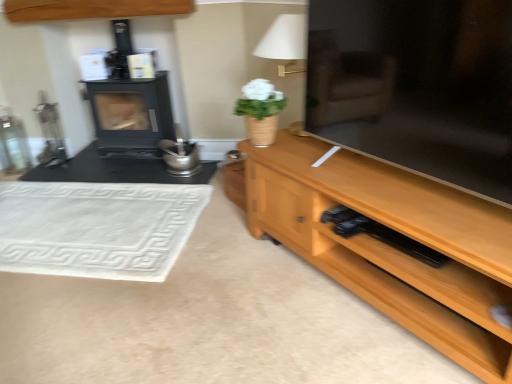
Question: Does point (36, 8) appear closer or farther from the camera than point (244, 102)?

Choices:
 (A) farther
 (B) closer

Answer: (A)

Question: Considering the positions of wooden cabinet at upper center and white matte vase at center in the image, is wooden cabinet at upper center wider or thinner than white matte vase at center?

Choices:
 (A) thin
 (B) wide

Answer: (A)

Question: Estimate the real-world distances between objects in this image. Which object is farther from the black matte wood burning stove at left?

Choices:
 (A) wooden cabinet at upper center
 (B) white fabric lampshade at upper center
 (C) wooden tv stand at right
 (D) white matte vase at center
 (E) white woven mat at lower left

Answer: (C)

Question: Which of these objects is positioned closest to the wooden cabinet at upper center?

Choices:
 (A) white woven mat at lower left
 (B) wooden tv stand at right
 (C) black matte wood burning stove at left
 (D) white fabric lampshade at upper center
 (E) white matte vase at center

Answer: (C)